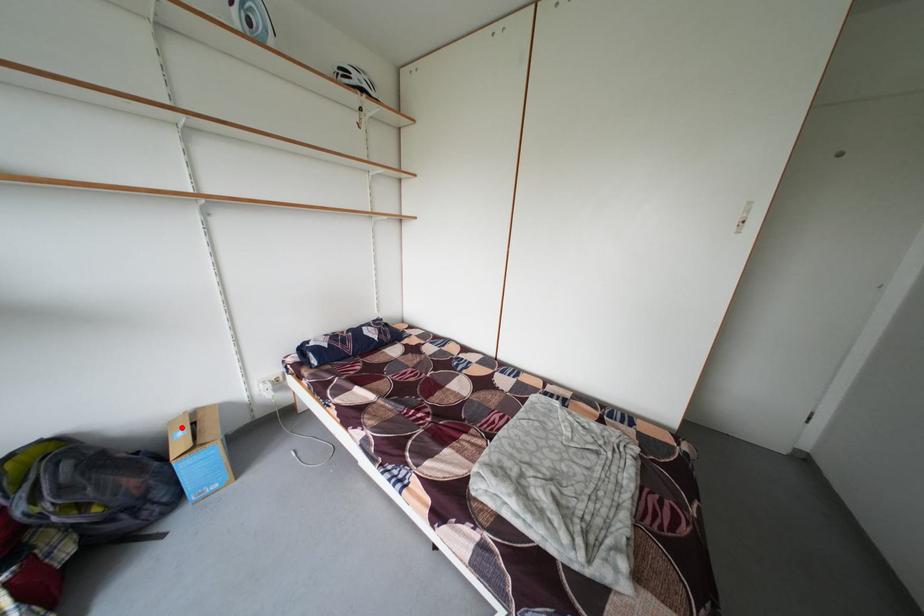
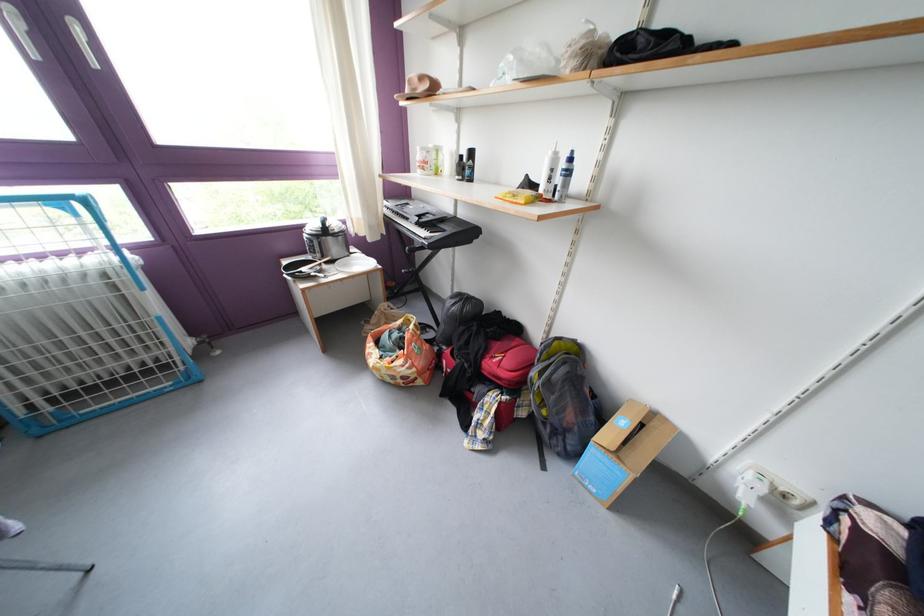
Question: I am providing you with two images of the same scene from different viewpoints. Given a red point in image1, look at the same physical point in image2. Is it:

Choices:
 (A) Closer to the viewpoint
 (B) Farther from the viewpoint

Answer: (A)